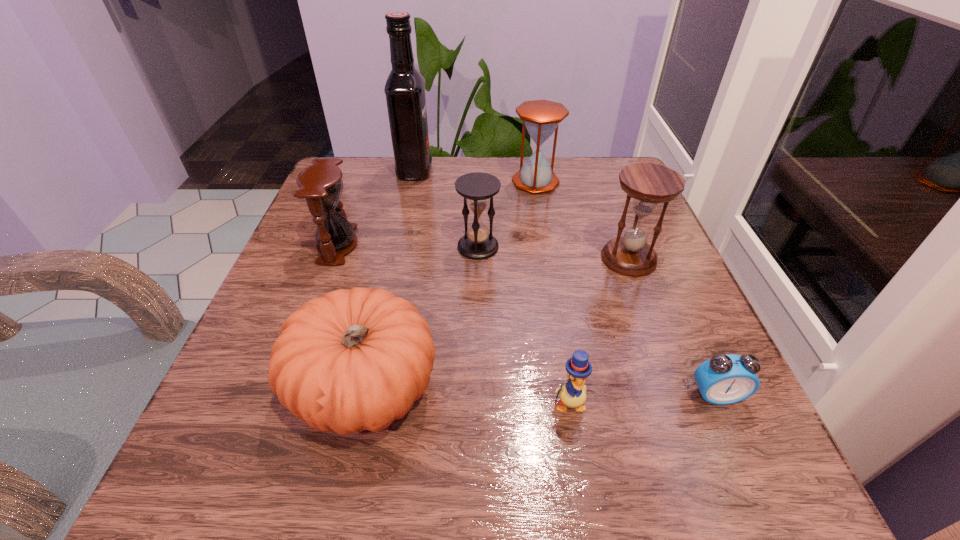
You are a GUI agent. You are given a task and a screenshot of the screen. Output one action in this format:
    pyautogui.click(x=<x>, y=<y>)
    Task: Click on the vacant region located on the front of the second hourglass from right to left
    Image resolution: width=960 pixels, height=540 pixels.
    Given the screenshot: What is the action you would take?
    pyautogui.click(x=548, y=252)

At what (x,y) coordinates should I click in order to perform the action: click on vacant area located on the front of the leftmost hourglass. Please return your answer as a coordinate pair (x, y). The height and width of the screenshot is (540, 960). Looking at the image, I should click on (x=296, y=357).

Find the location of a particular element. vacant space situated on the left of the second hourglass from left to right is located at coordinates (397, 247).

At what (x,y) coordinates should I click in order to perform the action: click on vacant space located 0.240m on the right of the pumpkin. Please return your answer as a coordinate pair (x, y). Looking at the image, I should click on (603, 389).

Where is `free space located 0.100m on the face of the duckling, where the monocle is placed`? free space located 0.100m on the face of the duckling, where the monocle is placed is located at coordinates (583, 491).

This screenshot has width=960, height=540. I want to click on vacant space located on the face of the shortest object, so click(x=764, y=503).

Identify the location of liquor situated at the far edge. Image resolution: width=960 pixels, height=540 pixels. (405, 87).

Image resolution: width=960 pixels, height=540 pixels. I want to click on hourglass situated at the far edge, so 541,118.

Locate an element on the screen. The height and width of the screenshot is (540, 960). object that is at the near edge is located at coordinates (351, 360).

The height and width of the screenshot is (540, 960). I want to click on hourglass positioned at the left edge, so click(x=321, y=185).